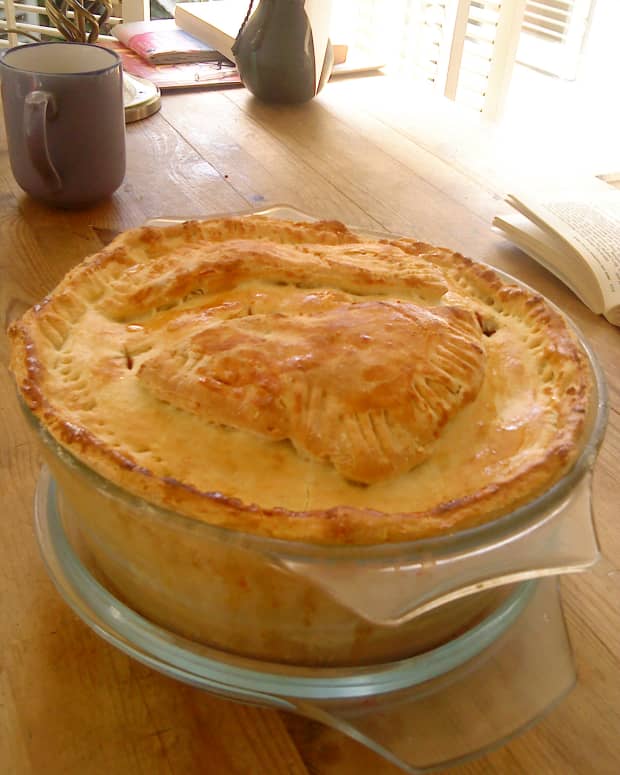
I want to click on holes on casserole top for air circulation, so click(490, 329), click(130, 360).